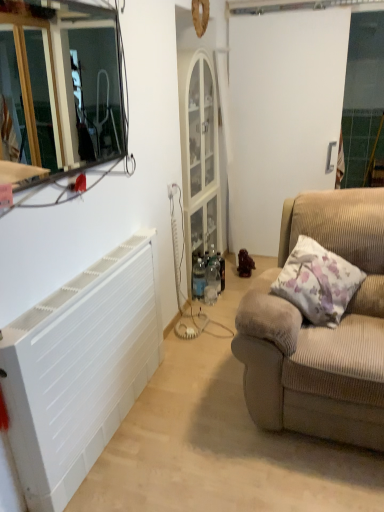
I want to click on vacant space to the left of beige corduroy couch at right, so click(195, 404).